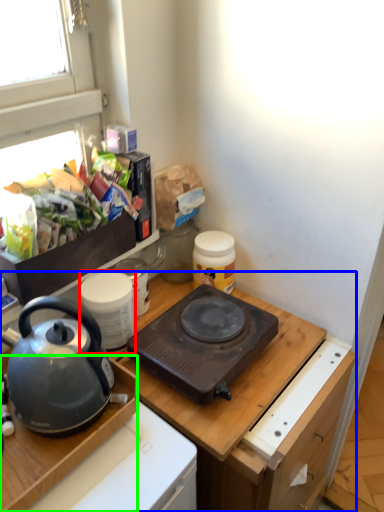
Question: Which object is the closest to the kitchen appliance (highlighted by a red box)? Choose among these: cabinetry (highlighted by a blue box) or desk (highlighted by a green box).

Choices:
 (A) cabinetry
 (B) desk

Answer: (B)